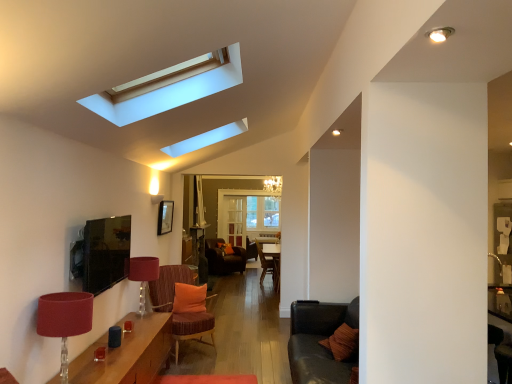
Question: In terms of width, does wooden table at lower left look wider or thinner when compared to orange fabric pillow at center?

Choices:
 (A) wide
 (B) thin

Answer: (A)

Question: From the image's perspective, is wooden table at lower left above or below orange fabric pillow at center?

Choices:
 (A) above
 (B) below

Answer: (A)

Question: Estimate the real-world distances between objects in this image. Which object is farther from the velvet orange chair at center?

Choices:
 (A) textured brown couch at lower right
 (B) matte red lampshade at lower left, which ranks as the 1th lamp in back-to-front order
 (C) wooden table at lower left
 (D) matte red lampshade at lower left, which appears as the 2th lamp when viewed from the back
 (E) velvet orange armchair at center

Answer: (E)

Question: Which object is the farthest from the velvet orange armchair at center?

Choices:
 (A) wooden table at lower left
 (B) velvet orange chair at center
 (C) textured brown couch at lower right
 (D) matte red lampshade at lower left, acting as the 1th lamp starting from the front
 (E) matte red lampshade at lower left, which ranks as the 1th lamp in back-to-front order

Answer: (D)